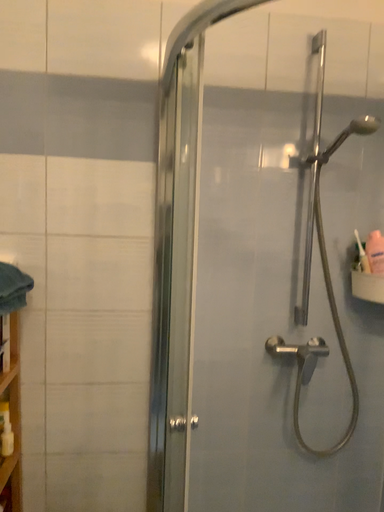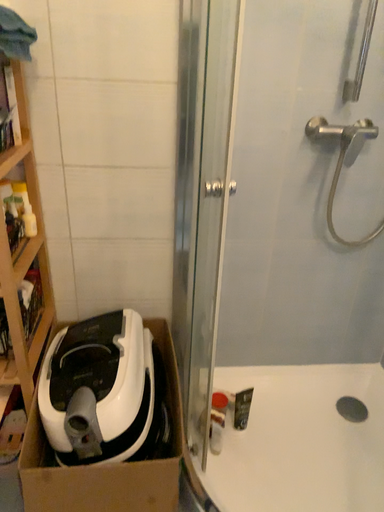
Question: How did the camera likely rotate when shooting the video?

Choices:
 (A) rotated downward
 (B) rotated upward

Answer: (A)